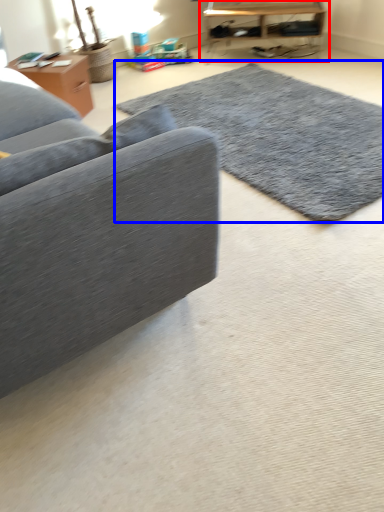
Question: Among these objects, which one is nearest to the camera, table (highlighted by a red box) or mat (highlighted by a blue box)?

Choices:
 (A) table
 (B) mat

Answer: (B)